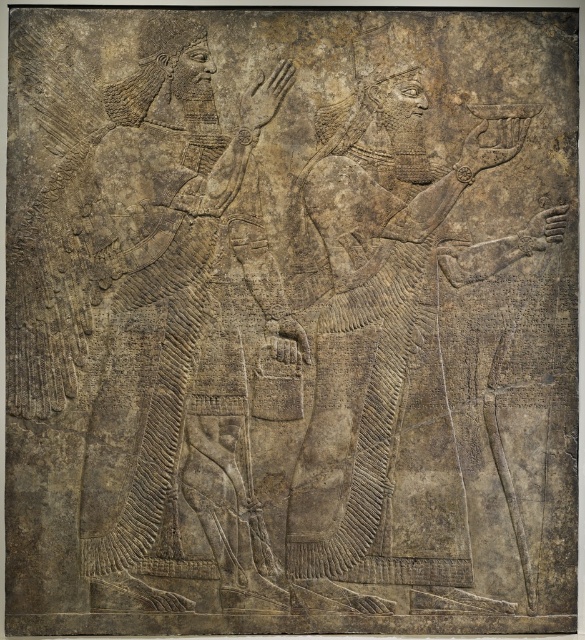
Is carved stone figure at center positioned before gray stone figure at left?

No.

Can you confirm if carved stone figure at center is thinner than gray stone figure at left?

No, carved stone figure at center is not thinner than gray stone figure at left.

Find the location of `carved stone figure at center`. carved stone figure at center is located at coordinates (390, 342).